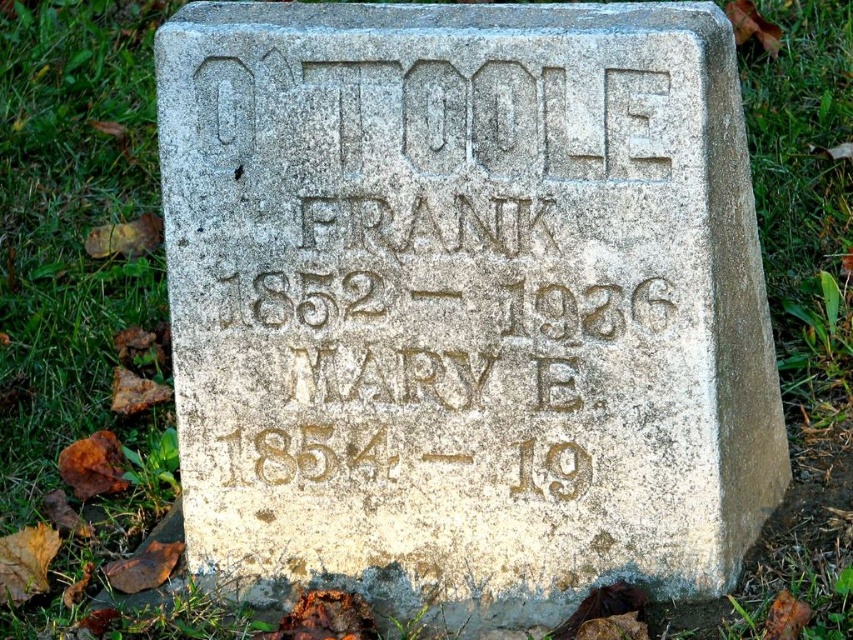
Who is higher up, gray stone gravestone at center or carved stone inscription at center?

Positioned higher is gray stone gravestone at center.

Does gray stone gravestone at center appear on the right side of carved stone inscription at center?

Yes, gray stone gravestone at center is to the right of carved stone inscription at center.

Between point (432, 529) and point (647, 280), which one is positioned in front?

Point (647, 280) is in front.

Find the location of `gray stone gravestone at center`. gray stone gravestone at center is located at coordinates (465, 300).